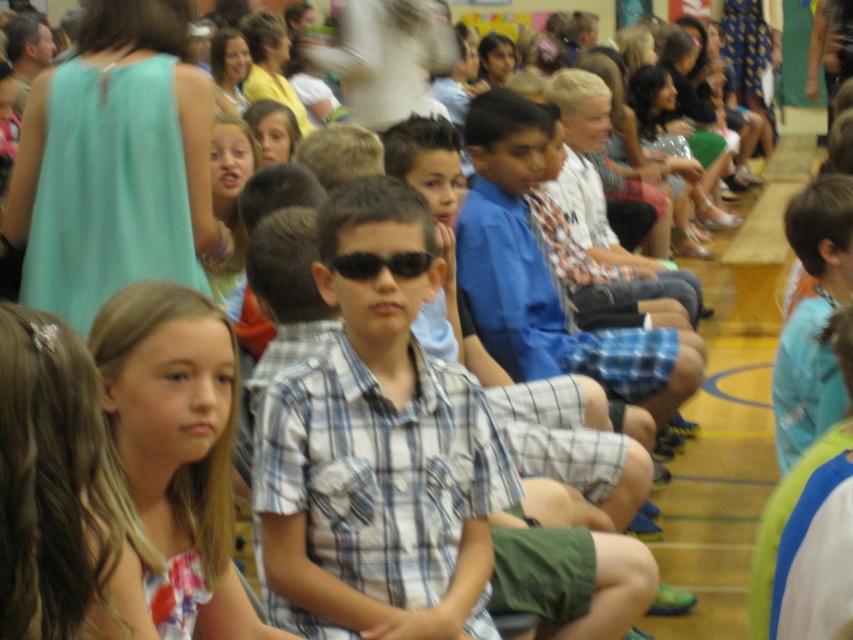
Consider the image. Does plaid shirt at center appear under blue plaid shirt at center?

Yes.

Does plaid shirt at center have a greater height compared to blue plaid shirt at center?

In fact, plaid shirt at center may be shorter than blue plaid shirt at center.

At what (x,y) coordinates should I click in order to perform the action: click on plaid shirt at center. Please return your answer as a coordinate pair (x, y). This screenshot has height=640, width=853. Looking at the image, I should click on 407,470.

The width and height of the screenshot is (853, 640). What are the coordinates of `plaid shirt at center` in the screenshot? It's located at (407, 470).

Can you confirm if blue plaid shirt at center is positioned below black plastic sunglasses at center?

No, blue plaid shirt at center is not below black plastic sunglasses at center.

Does blue plaid shirt at center appear on the left side of black plastic sunglasses at center?

No, blue plaid shirt at center is not to the left of black plastic sunglasses at center.

The image size is (853, 640). Identify the location of blue plaid shirt at center. (547, 275).

Which of these two, plaid shirt at center or black plastic sunglasses at center, stands shorter?

black plastic sunglasses at center is shorter.

Does plaid shirt at center appear over black plastic sunglasses at center?

Actually, plaid shirt at center is below black plastic sunglasses at center.

Is point (306, 515) positioned before point (357, 266)?

Yes.

The height and width of the screenshot is (640, 853). What are the coordinates of `plaid shirt at center` in the screenshot? It's located at (407, 470).